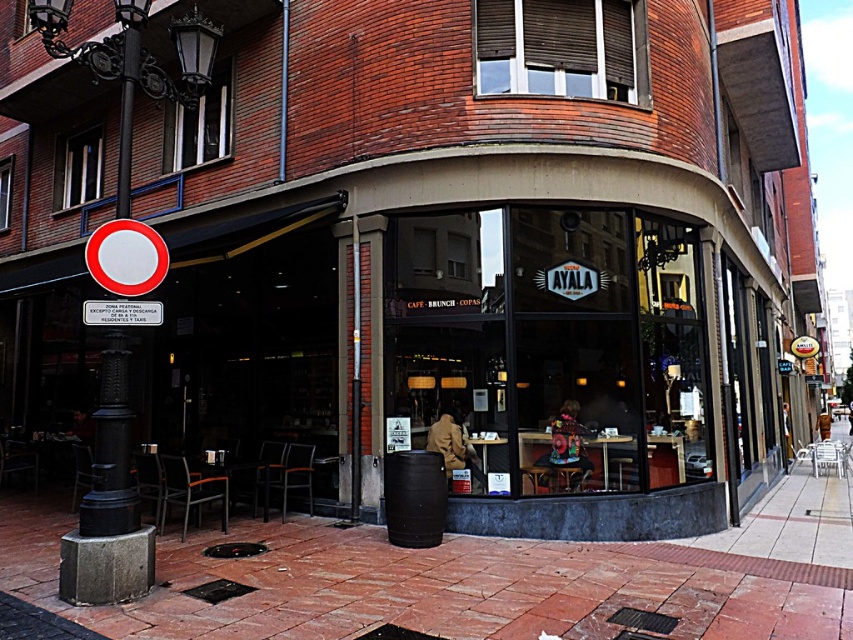
You are a delivery person with a cart that is 15 feet wide. You need to move from the brick pavement at lower center to the black cast iron pole at left. Is there enough space between them for your cart to pass through?

The distance between the brick pavement at lower center and the black cast iron pole at left is 20.45 feet. Since your cart is 15 feet wide, there is sufficient space for the cart to pass through as 20.45 feet is greater than 15 feet.

You are a customer approaching the entrance of the Ayala cafe. You see the brick pavement at lower center and the black cast iron pole at left. Which object is closer to the cafe entrance?

The brick pavement at lower center is closer to the cafe entrance because it is in front of the black cast iron pole at left.